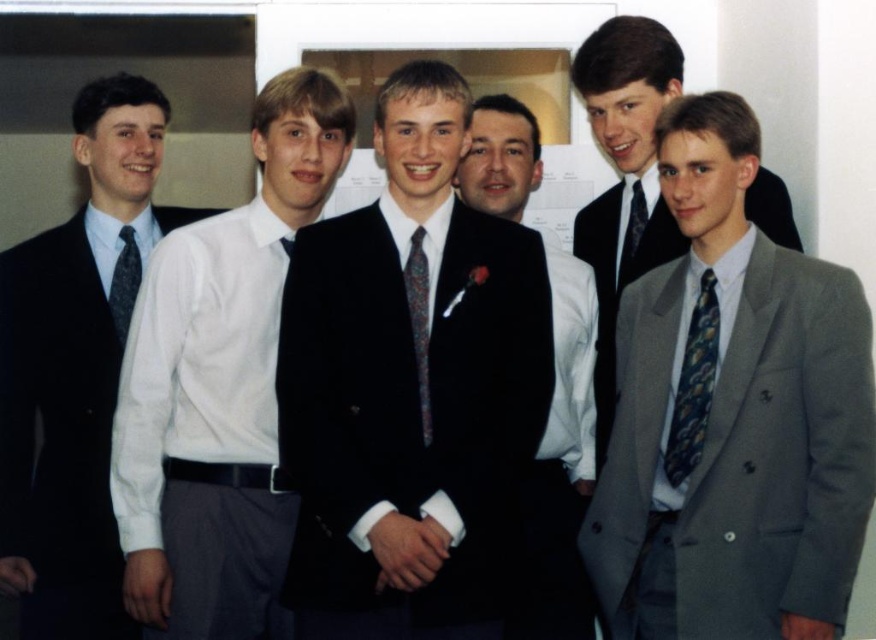
Question: Is matte black suit at left above black velvet suit at center?

Choices:
 (A) yes
 (B) no

Answer: (B)

Question: Which is nearer to the matte black suit at left?

Choices:
 (A) white glossy shirt at center
 (B) matte black tie at left

Answer: (B)

Question: Considering the relative positions of gray wool suit at right and dark blue textured tie at center in the image provided, where is gray wool suit at right located with respect to dark blue textured tie at center?

Choices:
 (A) above
 (B) below

Answer: (B)

Question: Is black velvet suit at center bigger than dark blue silk tie at right?

Choices:
 (A) yes
 (B) no

Answer: (A)

Question: Which object is positioned farthest from the black velvet suit at center?

Choices:
 (A) gray wool suit at right
 (B) dark blue patterned tie at center
 (C) white glossy shirt at center
 (D) dark blue silk tie at right

Answer: (C)

Question: Which of the following is the farthest from the observer?

Choices:
 (A) (415, 232)
 (B) (119, 324)
 (C) (749, 493)
 (D) (131, 195)

Answer: (D)